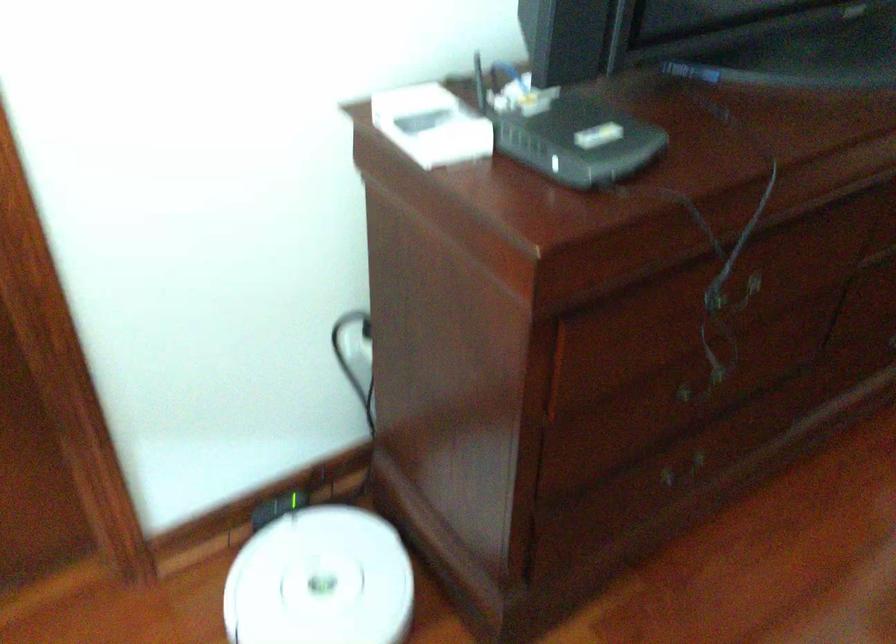
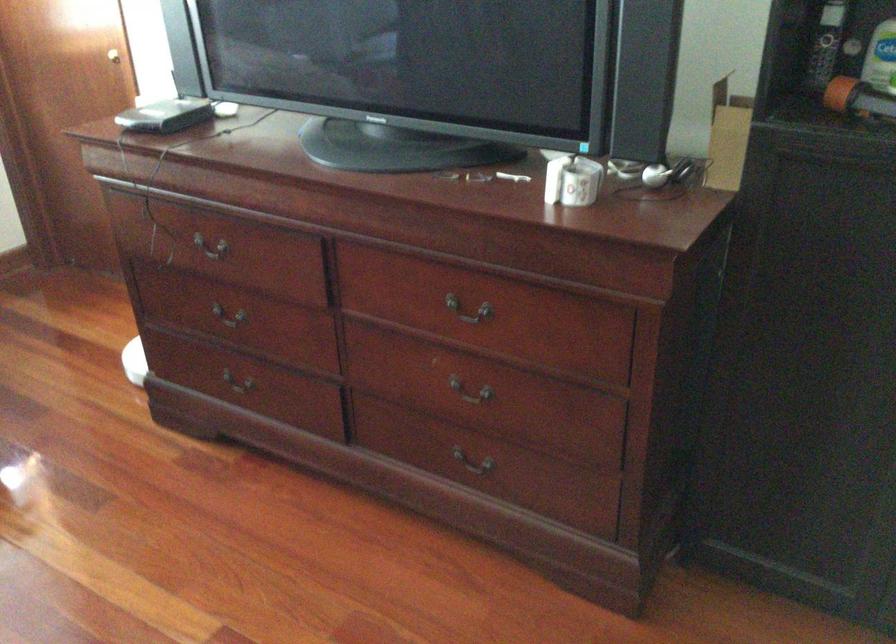
Locate, in the second image, the point that corresponds to the point at 622,475 in the first image.

(236, 391)